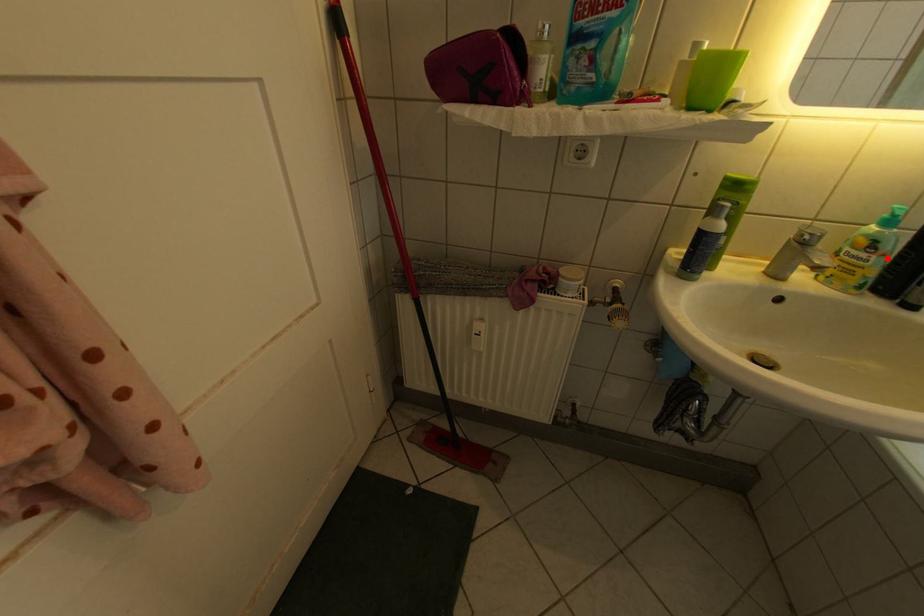
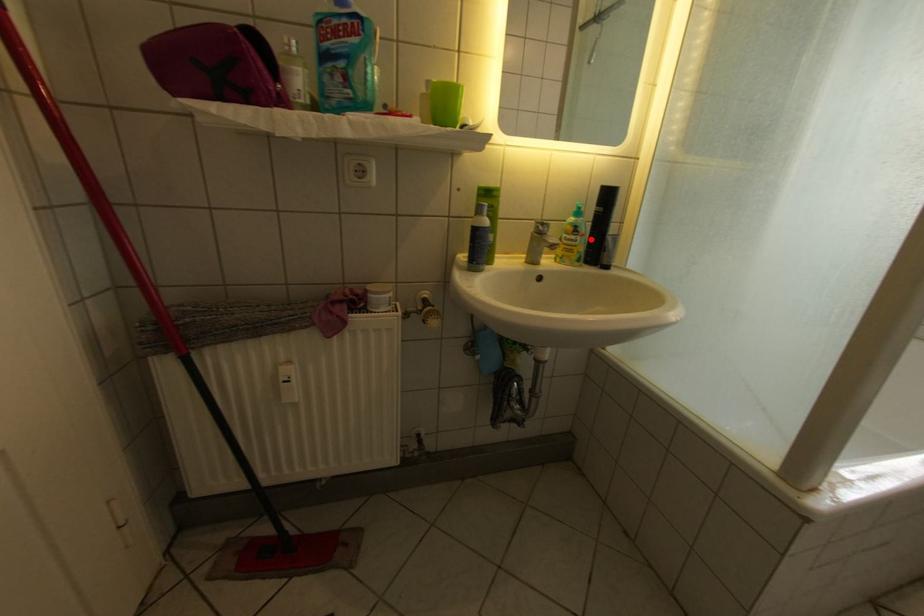
I am providing you with two images of the same scene from different viewpoints. A red point is marked on the first image and another point is marked on the second image. Are the points marked in image1 and image2 representing the same 3D position?

Yes